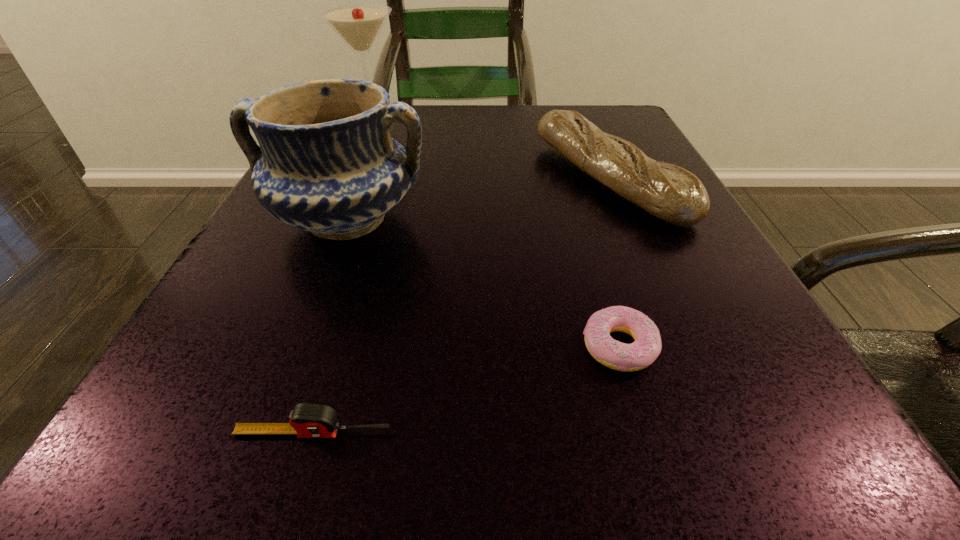
You are a GUI agent. You are given a task and a screenshot of the screen. Output one action in this format:
    pyautogui.click(x=<x>, y=<y>)
    Task: Click on the vacant point at the near right corner
    This screenshot has width=960, height=540.
    Given the screenshot: What is the action you would take?
    pyautogui.click(x=806, y=477)

Where is `free area in between the third shortest object and the pottery`? This screenshot has width=960, height=540. free area in between the third shortest object and the pottery is located at coordinates (477, 199).

At what (x,y) coordinates should I click in order to perform the action: click on empty location between the third shortest object and the pottery. Please return your answer as a coordinate pair (x, y). The width and height of the screenshot is (960, 540). Looking at the image, I should click on (477, 199).

You are a GUI agent. You are given a task and a screenshot of the screen. Output one action in this format:
    pyautogui.click(x=<x>, y=<y>)
    Task: Click on the vacant area between the fourth farthest object and the second shortest object
    
    Given the screenshot: What is the action you would take?
    pyautogui.click(x=467, y=389)

Locate an element on the screen. The height and width of the screenshot is (540, 960). blank region between the fourth tallest object and the second tallest object is located at coordinates (329, 326).

Where is `free space that is in between the pottery and the second shortest object`? This screenshot has width=960, height=540. free space that is in between the pottery and the second shortest object is located at coordinates (329, 326).

You are a GUI agent. You are given a task and a screenshot of the screen. Output one action in this format:
    pyautogui.click(x=<x>, y=<y>)
    Task: Click on the empty space between the pottery and the second shortest object
    The height and width of the screenshot is (540, 960).
    Given the screenshot: What is the action you would take?
    pyautogui.click(x=329, y=326)

Image resolution: width=960 pixels, height=540 pixels. Find the location of `free area in between the third tallest object and the farthest object`. free area in between the third tallest object and the farthest object is located at coordinates (491, 148).

Choose which object is the nearest neighbor to the baguet. Please provide its 2D coordinates. Your answer should be formatted as a tuple, i.e. [(x, y)], where the tuple contains the x and y coordinates of a point satisfying the conditions above.

[(647, 345)]

Identify which object is the fourth closest to the martini. Please provide its 2D coordinates. Your answer should be formatted as a tuple, i.e. [(x, y)], where the tuple contains the x and y coordinates of a point satisfying the conditions above.

[(307, 420)]